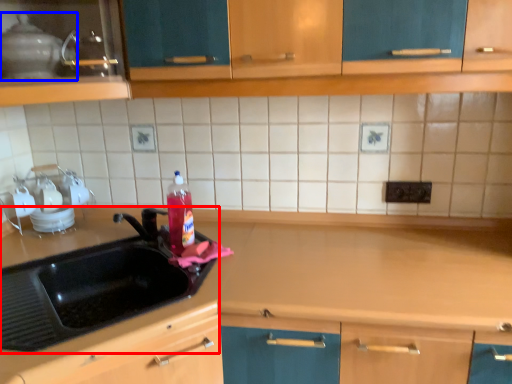
Question: Which object is further to the camera taking this photo, sink (highlighted by a red box) or appliance (highlighted by a blue box)?

Choices:
 (A) sink
 (B) appliance

Answer: (B)